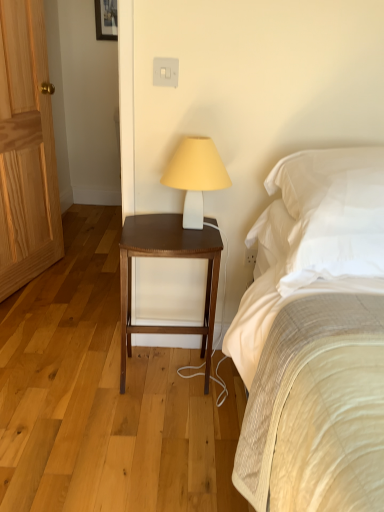
At what (x,y) coordinates should I click in order to perform the action: click on free space to the left of dark wood nightstand at center. Please return your answer as a coordinate pair (x, y). The image size is (384, 512). Looking at the image, I should click on (89, 379).